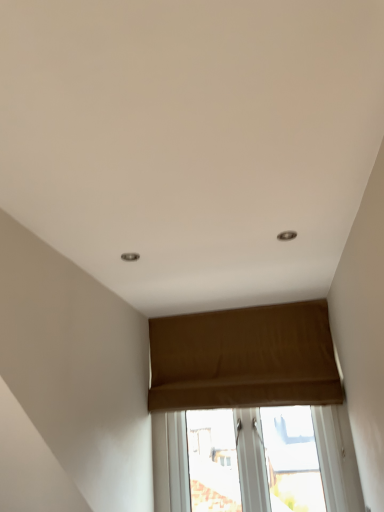
At what (x,y) coordinates should I click in order to perform the action: click on brown fabric window at center. Please return your answer as a coordinate pair (x, y). Looking at the image, I should click on (244, 357).

Describe the element at coordinates (244, 357) in the screenshot. The width and height of the screenshot is (384, 512). I see `brown fabric window at center` at that location.

Find the location of a particular element. This screenshot has width=384, height=512. brown fabric window at center is located at coordinates (244, 357).